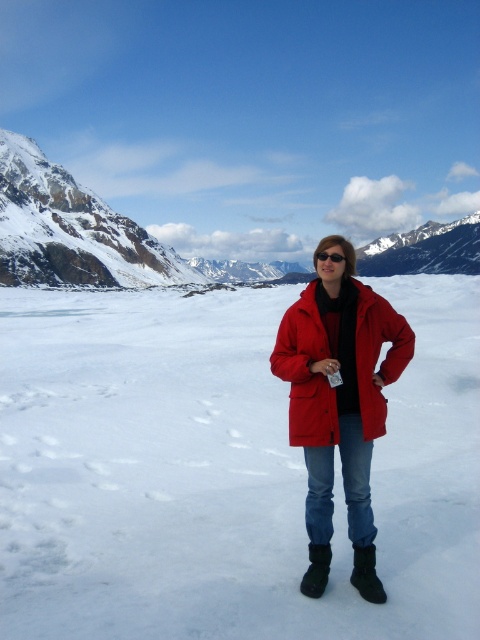
Question: Based on their relative distances, which object is nearer to the red plastic sunglasses at center?

Choices:
 (A) matte red jacket at center
 (B) snowy rocky mountain at upper left

Answer: (A)

Question: Can you confirm if matte red coat at center is positioned to the right of matte red jacket at center?

Choices:
 (A) yes
 (B) no

Answer: (A)

Question: Is snowy rocky mountain at upper left above red plastic sunglasses at center?

Choices:
 (A) yes
 (B) no

Answer: (A)

Question: Which object is positioned closest to the snowy rocky mountain at upper left?

Choices:
 (A) red plastic sunglasses at center
 (B) matte red jacket at center

Answer: (B)

Question: Among these points, which one is farthest from the camera?

Choices:
 (A) (331, 456)
 (B) (395, 614)
 (C) (143, 275)

Answer: (C)

Question: Where is white matte snow at center located in relation to snowy rocky mountain at upper left in the image?

Choices:
 (A) left
 (B) right

Answer: (B)